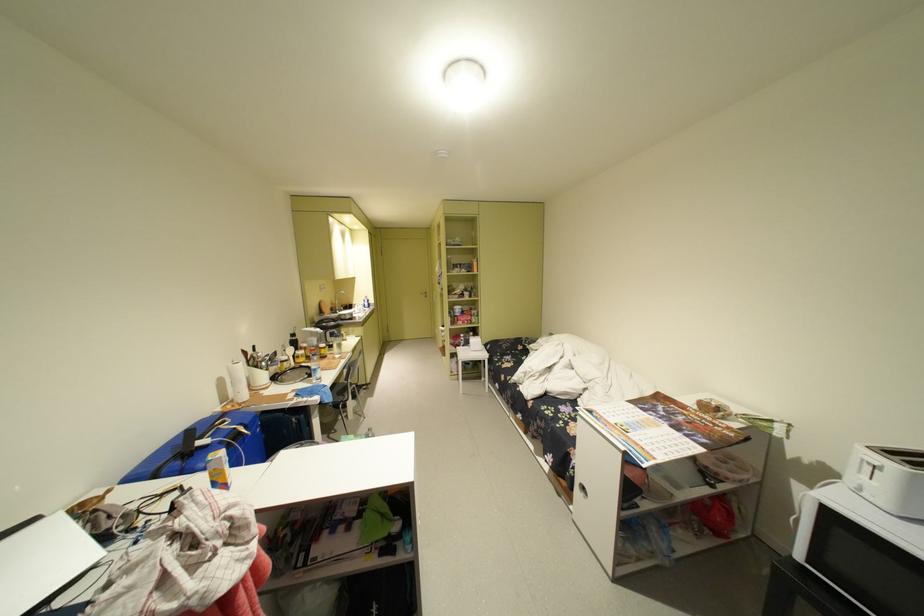
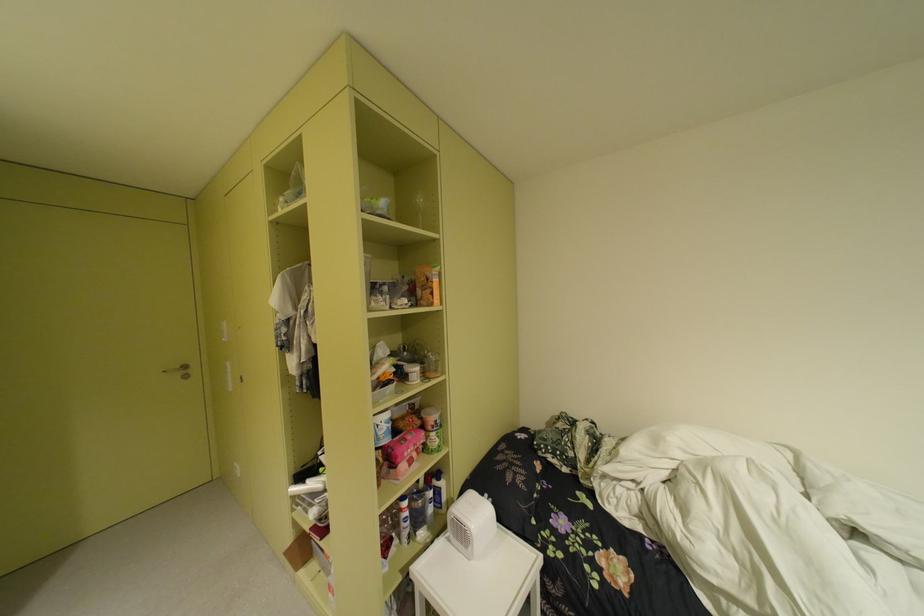
In the second image, find the point that corresponds to point (481, 297) in the first image.

(434, 376)